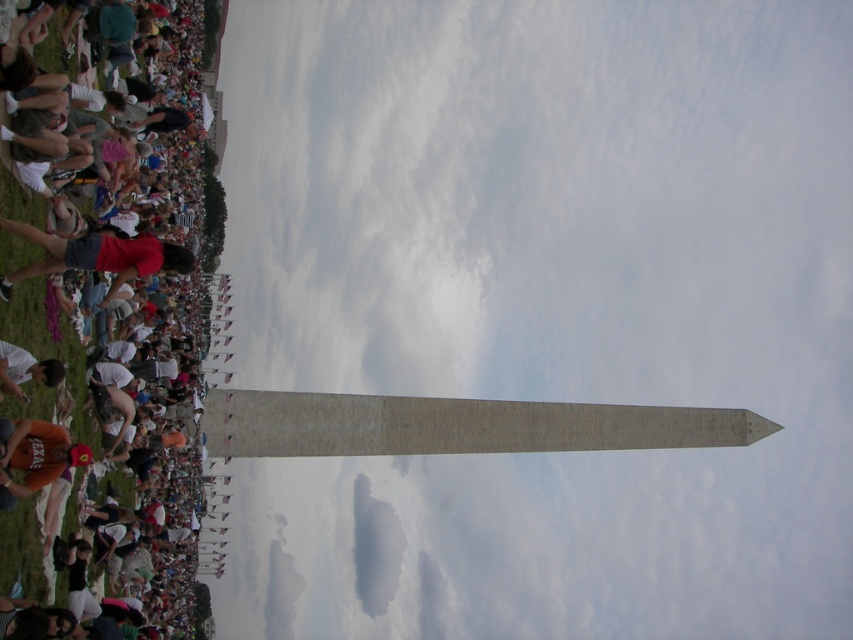
Between point (193, 560) and point (67, 268), which one is positioned in front?

Positioned in front is point (67, 268).

Between point (24, 337) and point (33, 241), which one is positioned in front?

Point (33, 241)

In order to click on white cotton t-shirts at left in this screenshot , I will do `click(54, 353)`.

Between white cotton t-shirts at left and matte black shirt at lower left, which one is positioned higher?

white cotton t-shirts at left

Is point (1, 320) farther from camera compared to point (51, 358)?

No, (1, 320) is closer to viewer.

Locate an element on the screen. Image resolution: width=853 pixels, height=640 pixels. white cotton t-shirts at left is located at coordinates (54, 353).

Who is taller, matte red shirt at left or matte black shirt at lower left?

matte red shirt at left is taller.

Who is more forward, (51,252) or (24,358)?

Point (24,358)

Does point (9, 225) lie in front of point (61, 371)?

Yes, it is in front of point (61, 371).

Find the location of `matte red shirt at left`. matte red shirt at left is located at coordinates (96, 257).